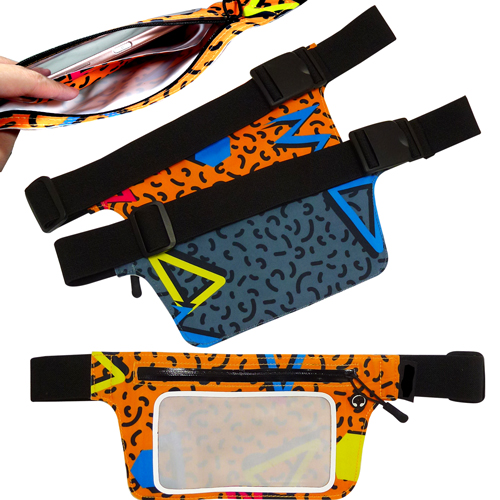
The width and height of the screenshot is (500, 500). I want to click on plastic clips, so click(281, 68), click(395, 136).